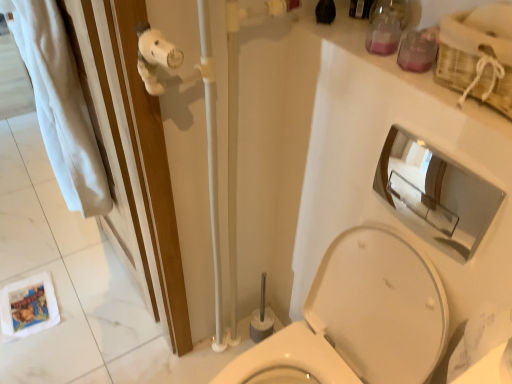
Question: In the image, is white plush toy at upper left positioned in front of or behind white glossy toilet at center?

Choices:
 (A) front
 (B) behind

Answer: (B)

Question: Choose the correct answer: Is white plush toy at upper left inside white glossy toilet at center or outside it?

Choices:
 (A) outside
 (B) inside

Answer: (A)

Question: Considering the real-world distances, which object is farthest from the pink glass jar at upper right, acting as the 1th toiletry starting from the top?

Choices:
 (A) chrome/metallic mirror at upper right
 (B) white plush toy at upper left
 (C) white glossy toilet at center
 (D) translucent plastic container at upper right, which is the 2th toiletry from back to front

Answer: (C)

Question: Which object is positioned farthest from the chrome/metallic mirror at upper right?

Choices:
 (A) white plush toy at upper left
 (B) pink glass jar at upper right, the 2th toiletry positioned from the front
 (C) white glossy toilet at center
 (D) translucent plastic container at upper right, acting as the 1th toiletry starting from the front

Answer: (A)